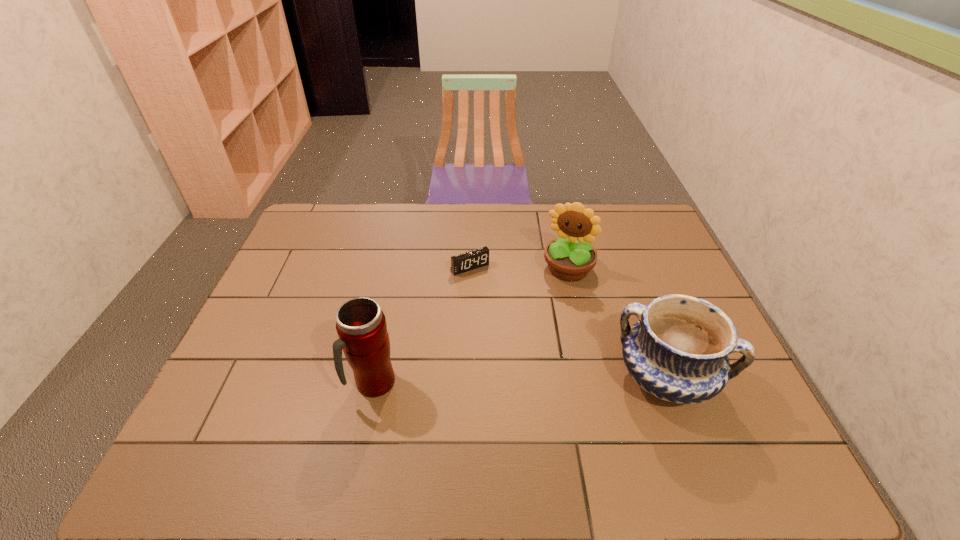
Identify the location of vacant space on the desktop that is between the thermos bottle and the pottery and is positioned on the front-facing side of the shortest object. (551, 380).

The width and height of the screenshot is (960, 540). I want to click on free space on the desktop that is between the thermos bottle and the pottery and is positioned on the face of the sunflower, so click(x=515, y=381).